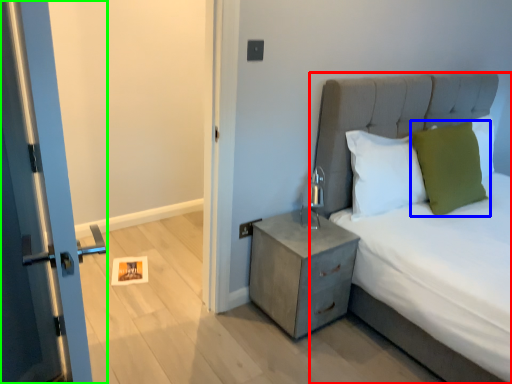
Question: Estimate the real-world distances between objects in this image. Which object is closer to bed (highlighted by a red box), pillow (highlighted by a blue box) or door (highlighted by a green box)?

Choices:
 (A) pillow
 (B) door

Answer: (A)